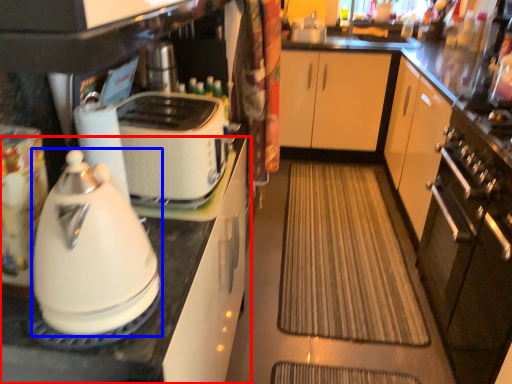
Question: Which point is closer to the camera, cabinetry (highlighted by a red box) or kitchen appliance (highlighted by a blue box)?

Choices:
 (A) cabinetry
 (B) kitchen appliance

Answer: (B)